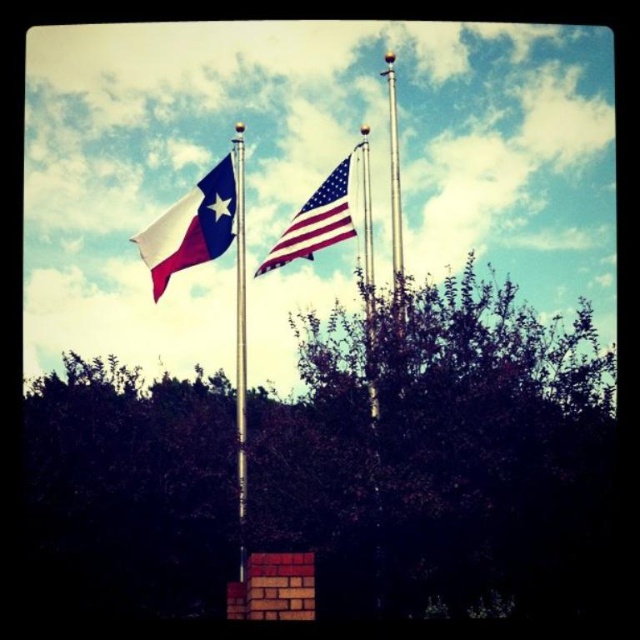
Can you confirm if green leafy tree at center is positioned to the left of american flag at center?

Incorrect, green leafy tree at center is not on the left side of american flag at center.

Does point (134, 486) lie behind point (310, 202)?

No, (134, 486) is closer to viewer.

This screenshot has width=640, height=640. I want to click on green leafy tree at center, so click(444, 458).

Can you confirm if green leafy tree at center is positioned above polished metal flag pole at center?

No, green leafy tree at center is not above polished metal flag pole at center.

Which is above, green leafy tree at center or polished metal flag pole at center?

polished metal flag pole at center is above.

I want to click on green leafy tree at center, so click(x=444, y=458).

Does green leafy tree at center come in front of matte blue flag at left?

Yes.

Is green leafy tree at center bigger than matte blue flag at left?

Indeed, green leafy tree at center has a larger size compared to matte blue flag at left.

The width and height of the screenshot is (640, 640). I want to click on green leafy tree at center, so click(444, 458).